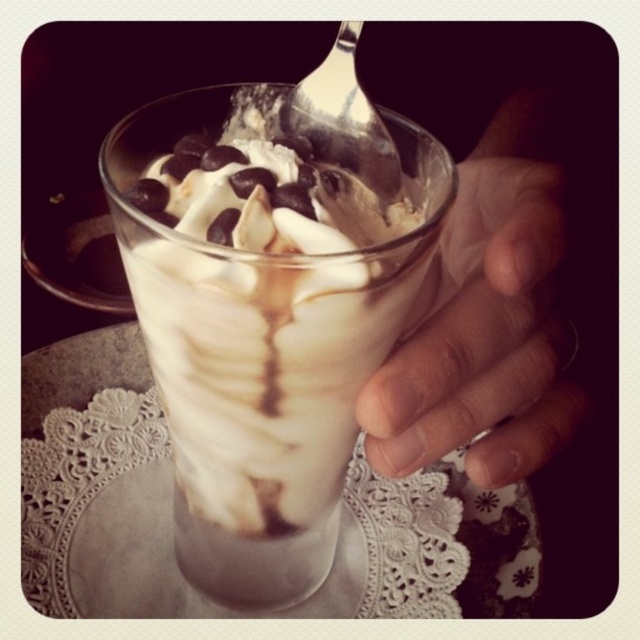
You are a chef observing a dessert being prepared. You see a smooth skin hand at right and a silver metallic spoon at upper center. Which object is located to the right of the other?

The smooth skin hand at right is to the right of the silver metallic spoon at upper center.

Consider the image. You are trying to take a photo of the dessert without the hand in the frame. The smooth skin hand at right is currently holding the glass. Based on its position at point coordinates, can you estimate if moving the camera slightly to the left would remove the hand from the photo?

The smooth skin hand at right is positioned at coordinates point (x=484, y=333). Moving the camera slightly to the left might shift the frame to exclude the hand, but precise adjustments depend on the camera angle and distance. However, since the hand is at the right side, moving left could help remove it from the frame.